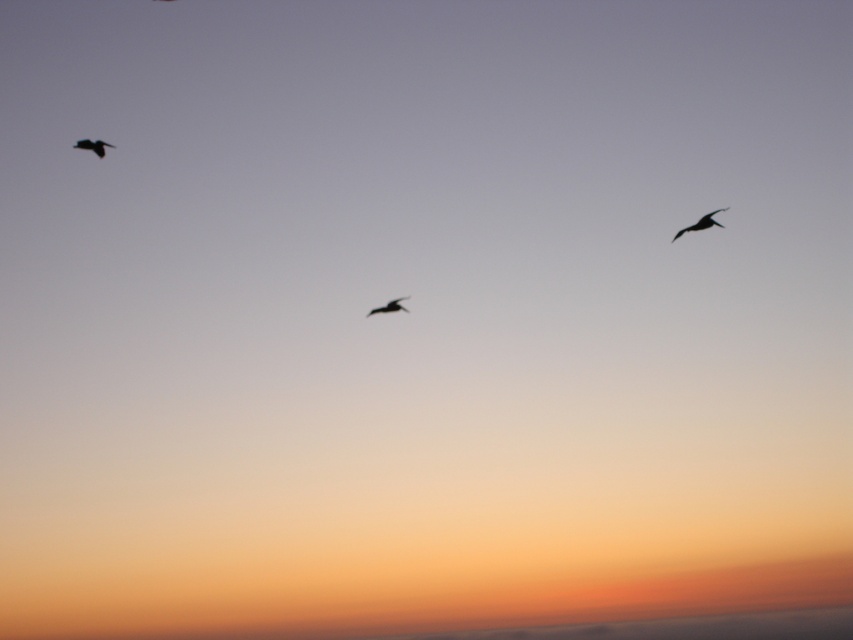
Is silhouette feathered bird at upper left bigger than black matte bird at center?

No, silhouette feathered bird at upper left is not bigger than black matte bird at center.

From the picture: Who is shorter, silhouette feathered bird at upper left or black matte bird at center?

With less height is black matte bird at center.

What do you see at coordinates (91, 145) in the screenshot? I see `silhouette feathered bird at upper left` at bounding box center [91, 145].

Identify the location of silhouette feathered bird at upper left. tap(91, 145).

Where is `black matte bird at upper right`? The height and width of the screenshot is (640, 853). black matte bird at upper right is located at coordinates (701, 224).

Measure the distance between black matte bird at upper right and camera.

black matte bird at upper right is 118.78 feet away from camera.

The image size is (853, 640). Find the location of `black matte bird at upper right`. black matte bird at upper right is located at coordinates (701, 224).

In the scene shown: Who is positioned more to the left, black matte bird at upper right or silhouette feathered bird at upper left?

Positioned to the left is silhouette feathered bird at upper left.

Which is above, black matte bird at upper right or silhouette feathered bird at upper left?

silhouette feathered bird at upper left is higher up.

What are the coordinates of `black matte bird at upper right` in the screenshot? It's located at (701, 224).